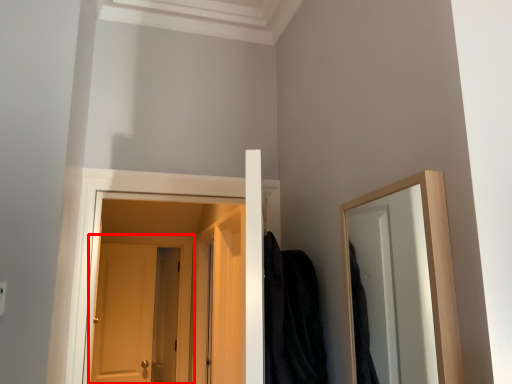
Question: Observing the image, what is the correct spatial positioning of door (annotated by the red box) in reference to robe?

Choices:
 (A) right
 (B) left

Answer: (B)